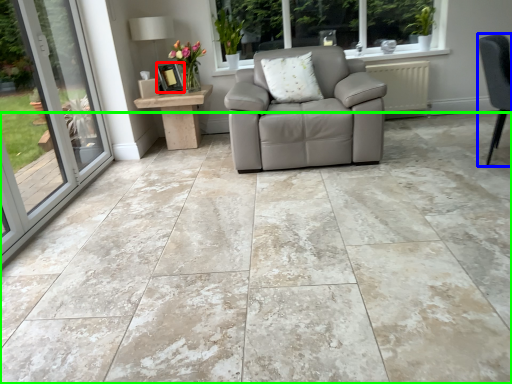
Question: Which is nearer to the picture frame (highlighted by a red box)? chair (highlighted by a blue box) or concrete (highlighted by a green box).

Choices:
 (A) chair
 (B) concrete

Answer: (B)